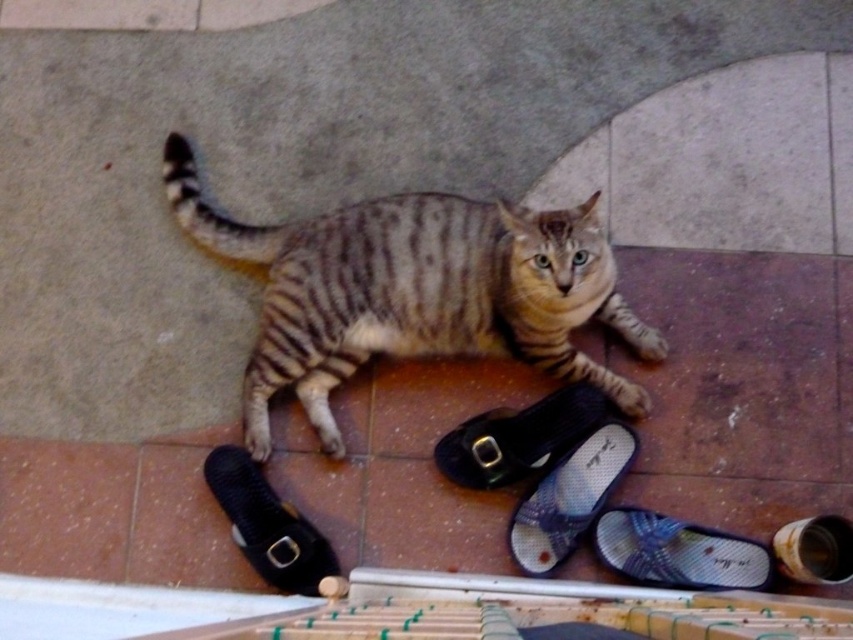
Question: Which object is farther from the camera taking this photo?

Choices:
 (A) blue fabric slipper at lower right
 (B) striped fur cat at center
 (C) black leather shoe at center
 (D) blue fabric slipper at lower center

Answer: (C)

Question: Estimate the real-world distances between objects in this image. Which object is closer to the blue fabric slipper at lower center?

Choices:
 (A) black leather shoe at center
 (B) striped fur cat at center
 (C) black fabric slipper at lower left
 (D) blue fabric slipper at lower right

Answer: (A)

Question: Is blue fabric slipper at lower right behind blue fabric slipper at lower center?

Choices:
 (A) yes
 (B) no

Answer: (B)

Question: Observing the image, what is the correct spatial positioning of black leather shoe at center in reference to blue fabric slipper at lower center?

Choices:
 (A) below
 (B) above

Answer: (B)

Question: Does black leather shoe at center appear under blue fabric slipper at lower right?

Choices:
 (A) yes
 (B) no

Answer: (B)

Question: Which point is closer to the camera?

Choices:
 (A) black fabric slipper at lower left
 (B) black leather shoe at center
 (C) blue fabric slipper at lower right
 (D) blue fabric slipper at lower center

Answer: (C)